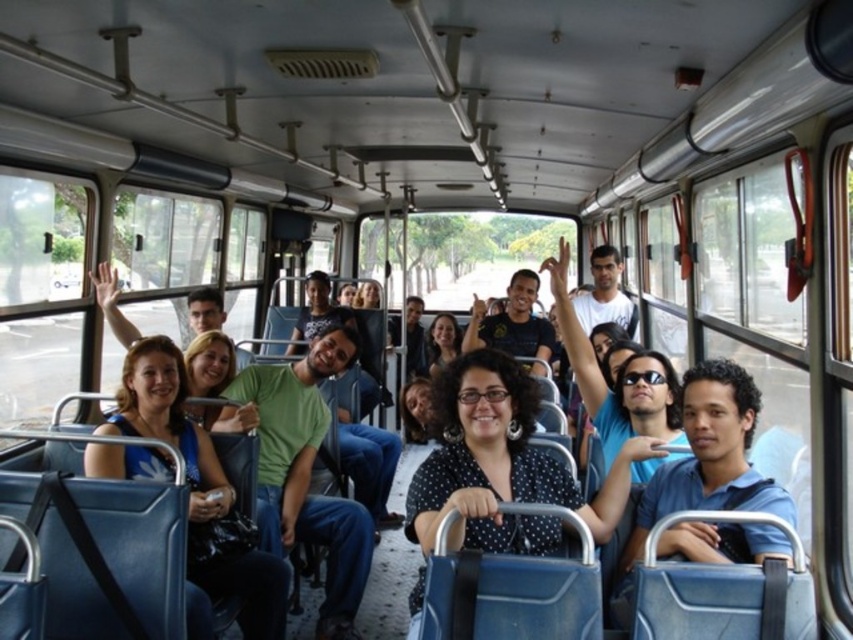
You are a passenger on the bus and want to see the view outside the window. The black dotted blouse at center and the green matte shirt at center are blocking your view. Which one should you move around to get a clear view?

You should move around the black dotted blouse at center because it is in front of the green matte shirt at center, so moving around it would provide a clearer view.

You are a passenger on a crowded bus and need to reach the front door. You notice two points marked on the bus floor. The first is at point (296, 486) and the second is at point (161, 339). Which point is closer to you as you stand near the back of the bus?

Point (296, 486) is further to the viewer than point (161, 339). Since you are standing near the back of the bus, the closer point would be point (161, 339) because it is nearer to your position.

In the scene shown: You are standing at the point labeled point (488,353) on the bus. You need to reach the door at the back of the bus, which is 7.14 feet away. If your average walking speed is 3 feet per second, how many seconds will it take you to reach the door?

The distance to the door is 7.14 feet, and your walking speed is 3 feet per second. To calculate the time, divide the distance by the speed. 7.14 divided by 3 equals approximately 2.38 seconds. Therefore, it will take about 2.38 seconds to reach the door.